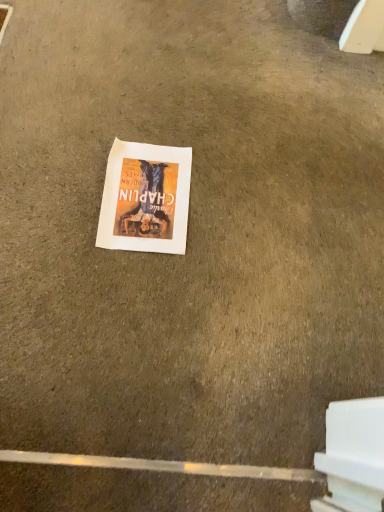
This screenshot has width=384, height=512. Find the location of `free location above white paper poster at center (from a real-world perspective)`. free location above white paper poster at center (from a real-world perspective) is located at coordinates (142, 190).